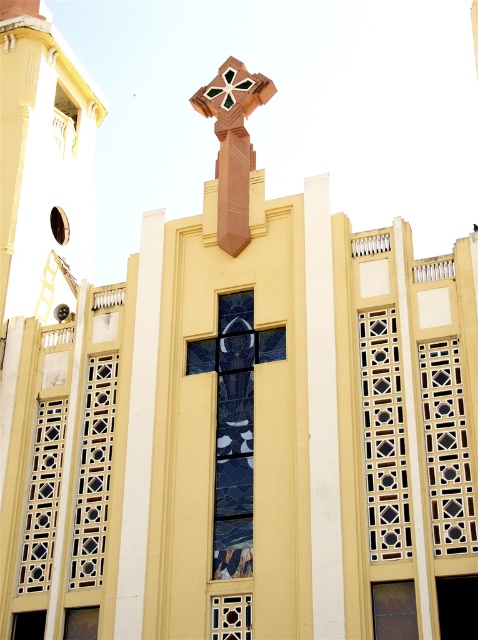
You are an architect reviewing the building facade shown. You need to install a new light fixture that requires a minimum height of 2 meters. Which of the two windows, the matte white window at upper left or the matte brown window at lower left, can accommodate the fixture based on their height?

The matte white window at upper left has a greater height compared to the matte brown window at lower left. Since the light fixture requires a minimum height of 2 meters, the matte white window at upper left is the one that can accommodate the fixture.

You are standing in front of the building depicted in the image. A point labeled at coordinates (446, 449) is marked on the image. Based on the scene description, what object or feature is located at this point?

The point at coordinates (446, 449) indicates the translucent glass lattice at center right.